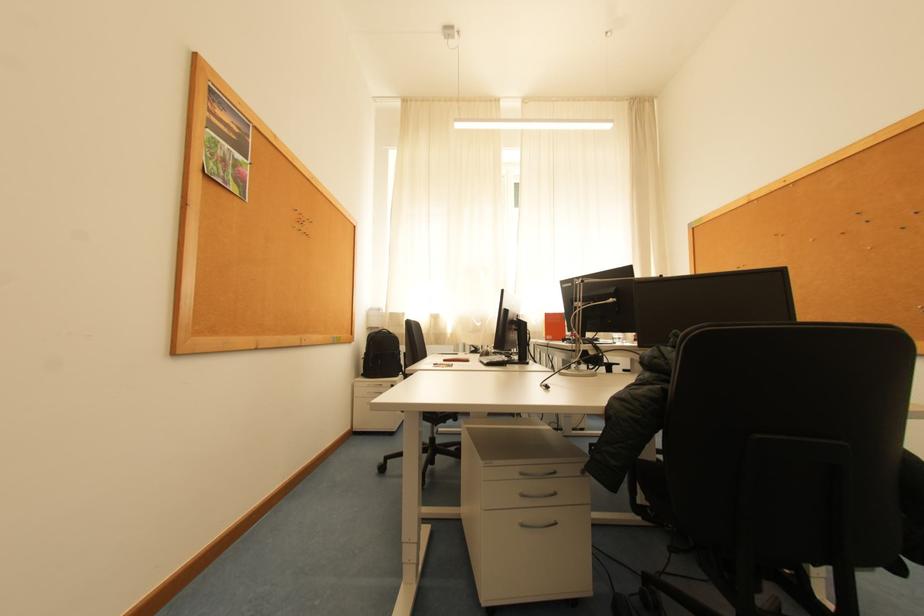
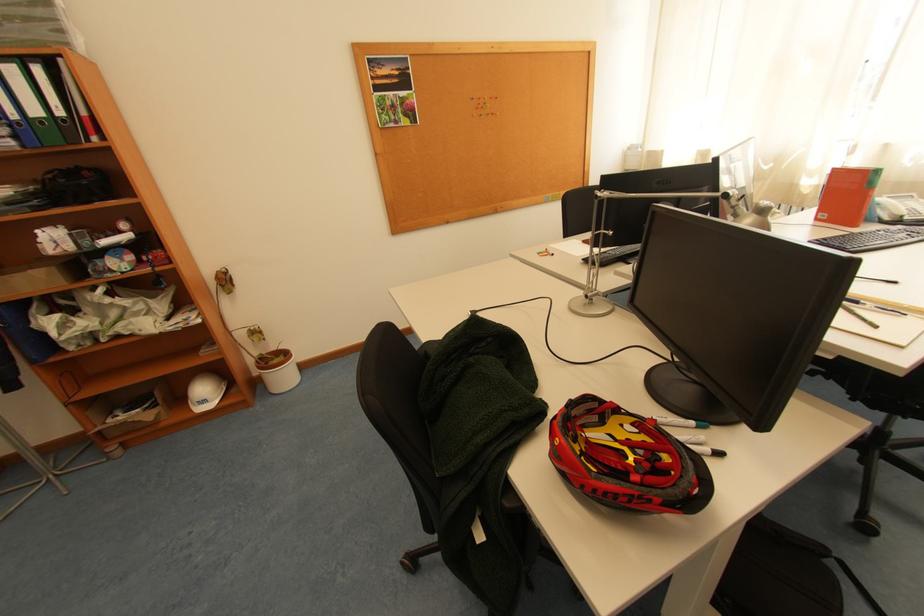
Where in the second image is the point corresponding to pixel 301 228 from the first image?

(481, 118)